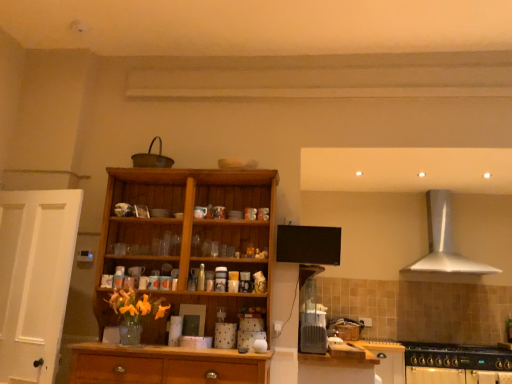
Question: From a real-world perspective, is silver metallic range hood at upper right positioned above or below white matte cabinet at lower right, which is the 2th cabinetry from front to back?

Choices:
 (A) below
 (B) above

Answer: (B)

Question: In terms of height, does silver metallic range hood at upper right look taller or shorter compared to white matte cabinet at lower right, which is the 2th cabinetry from front to back?

Choices:
 (A) short
 (B) tall

Answer: (B)

Question: Which object is the farthest from the black matte gas stove at lower right?

Choices:
 (A) wooden cabinet at center
 (B) white matte door at left
 (C) wooden cabinet at lower center, the 2th cabinetry from the back
 (D) white matte cabinet at lower right, acting as the 2th cabinetry starting from the left
 (E) silver metallic range hood at upper right

Answer: (B)

Question: Considering the real-world distances, which object is closest to the white matte door at left?

Choices:
 (A) wooden cabinet at lower center, positioned as the 1th cabinetry in front-to-back order
 (B) wooden cabinet at center
 (C) silver metallic range hood at upper right
 (D) black matte gas stove at lower right
 (E) white matte cabinet at lower right, acting as the 2th cabinetry starting from the left

Answer: (B)